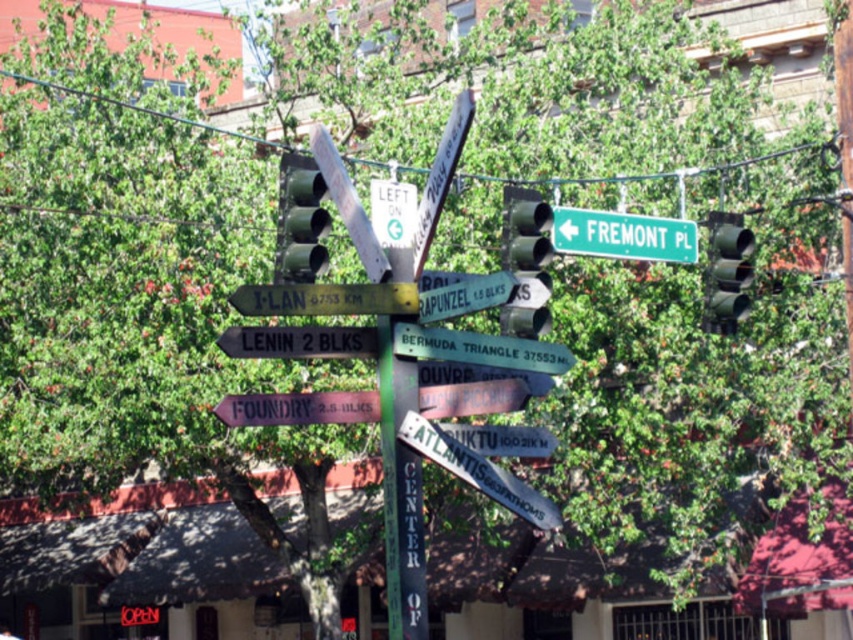
Question: Is brown wooden sign at lower center to the right of green matte street sign at center from the viewer's perspective?

Choices:
 (A) no
 (B) yes

Answer: (A)

Question: Based on their relative distances, which object is nearer to the green matte street sign at center?

Choices:
 (A) metallic green traffic light at upper right
 (B) white plastic signpost at upper center
 (C) green matte signpost at center
 (D) green matte traffic light at upper right

Answer: (B)

Question: Among these points, which one is nearest to the camera?

Choices:
 (A) (419, 216)
 (B) (302, 170)

Answer: (B)

Question: Does brown wooden sign at lower center appear under metallic silver sign at center?

Choices:
 (A) no
 (B) yes

Answer: (A)

Question: Does white plastic sign at lower left have a greater width compared to metallic reflective sign at center?

Choices:
 (A) no
 (B) yes

Answer: (B)

Question: Which object appears farthest from the camera in this image?

Choices:
 (A) metallic green traffic light at upper right
 (B) metallic silver sign at center

Answer: (B)